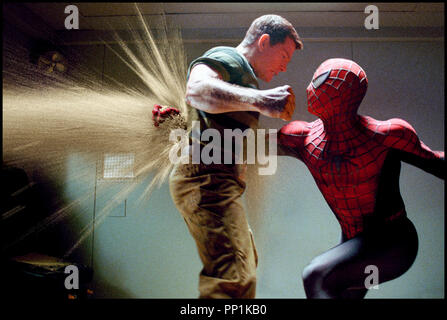
The width and height of the screenshot is (447, 320). I want to click on wall, so click(168, 211).